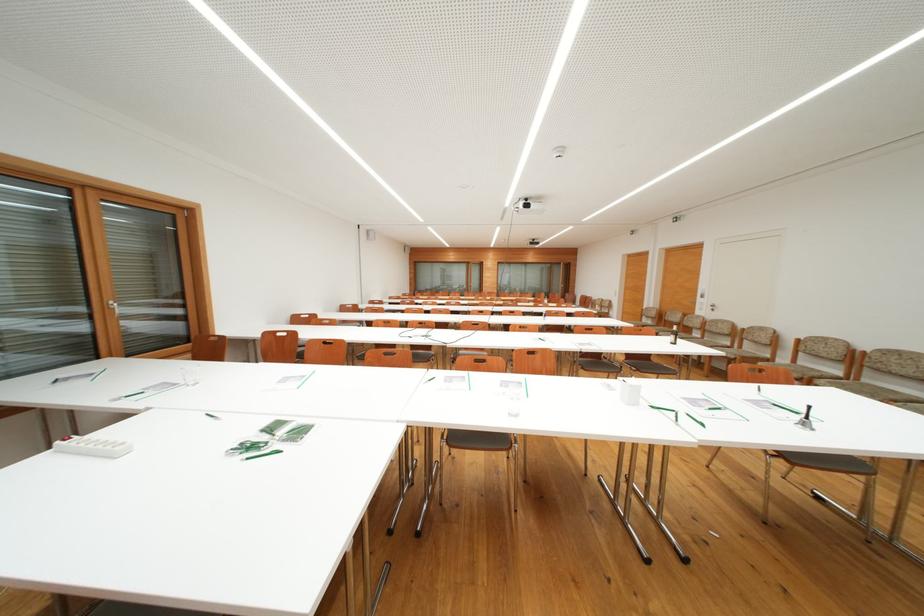
Describe the element at coordinates (114, 307) in the screenshot. I see `the silver window handle` at that location.